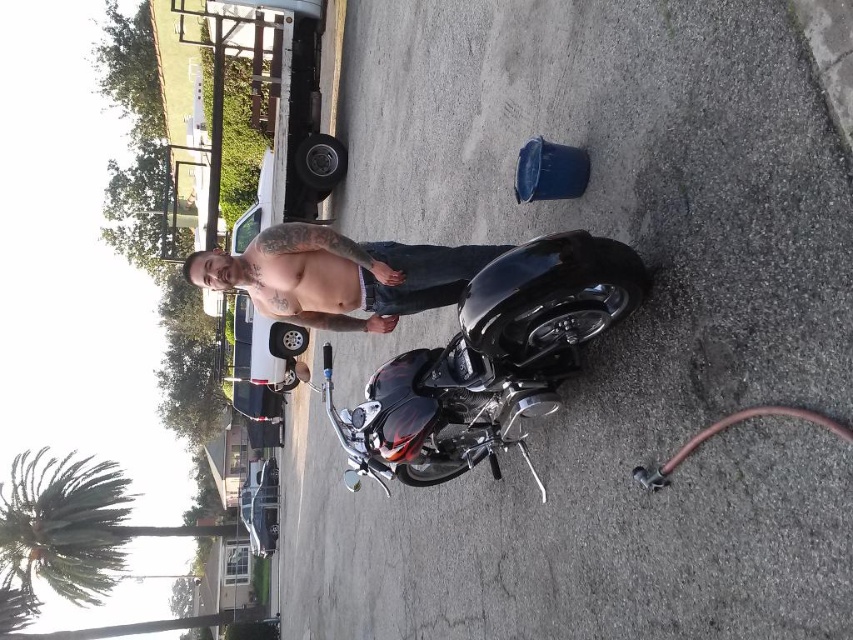
Question: Can you confirm if glossy black motorcycle at center is wider than muscular skin at center?

Choices:
 (A) yes
 (B) no

Answer: (A)

Question: Which point is farther to the camera?

Choices:
 (A) glossy black motorcycle at center
 (B) shiny metallic torso at center
 (C) muscular skin at center

Answer: (C)

Question: Can you confirm if glossy black motorcycle at center is positioned above shiny metallic torso at center?

Choices:
 (A) yes
 (B) no

Answer: (B)

Question: Which point is closer to the camera taking this photo?

Choices:
 (A) (306, 268)
 (B) (306, 262)
 (C) (450, 365)

Answer: (A)

Question: Considering the real-world distances, which object is closest to the muscular skin at center?

Choices:
 (A) glossy black motorcycle at center
 (B) green leafy palm tree at lower left

Answer: (A)

Question: Does shiny metallic torso at center have a smaller size compared to muscular skin at center?

Choices:
 (A) no
 (B) yes

Answer: (A)